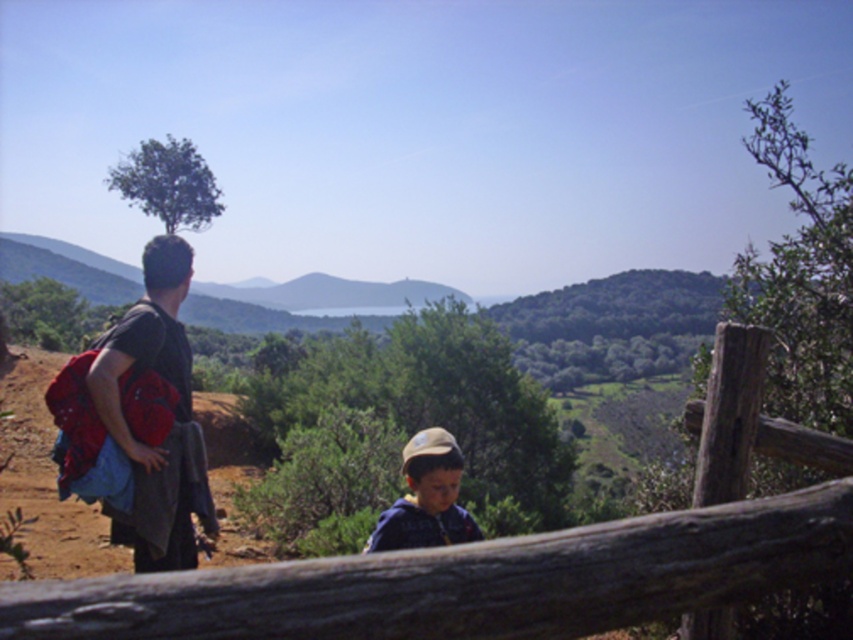
Can you confirm if matte black backpack at left is positioned to the left of blue cotton shirt at center?

Yes, matte black backpack at left is to the left of blue cotton shirt at center.

Where is `matte black backpack at left`? The image size is (853, 640). matte black backpack at left is located at coordinates (161, 378).

Where is `matte black backpack at left`? matte black backpack at left is located at coordinates (161, 378).

Who is positioned more to the right, wooden log at center or matte black backpack at left?

Positioned to the right is wooden log at center.

Which is below, wooden log at center or matte black backpack at left?

Positioned lower is wooden log at center.

Identify the location of wooden log at center. (469, 580).

Does wooden log at center have a lesser height compared to blue cotton shirt at center?

Indeed, wooden log at center has a lesser height compared to blue cotton shirt at center.

Is point (720, 588) farther from viewer compared to point (399, 524)?

No.

The image size is (853, 640). Find the location of `wooden log at center`. wooden log at center is located at coordinates (469, 580).